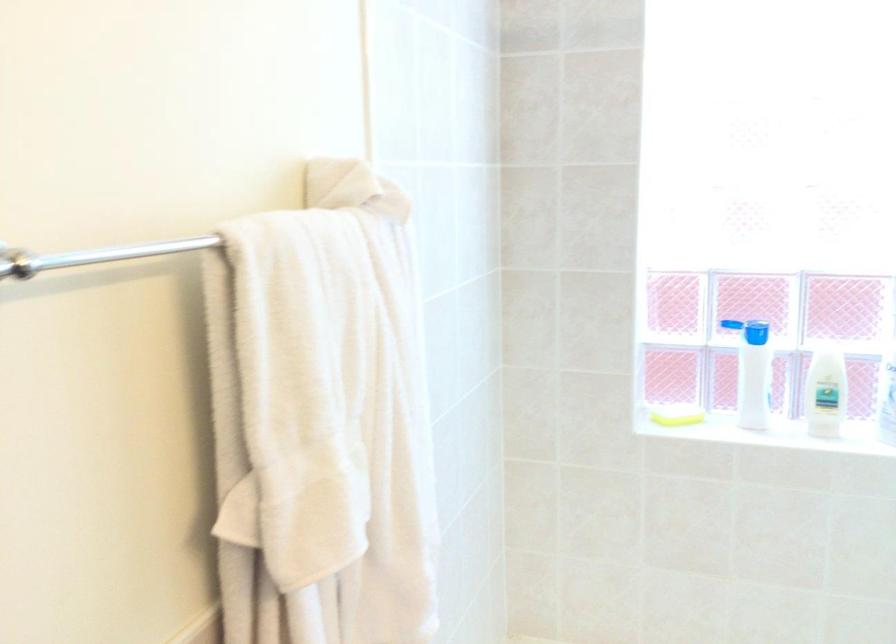
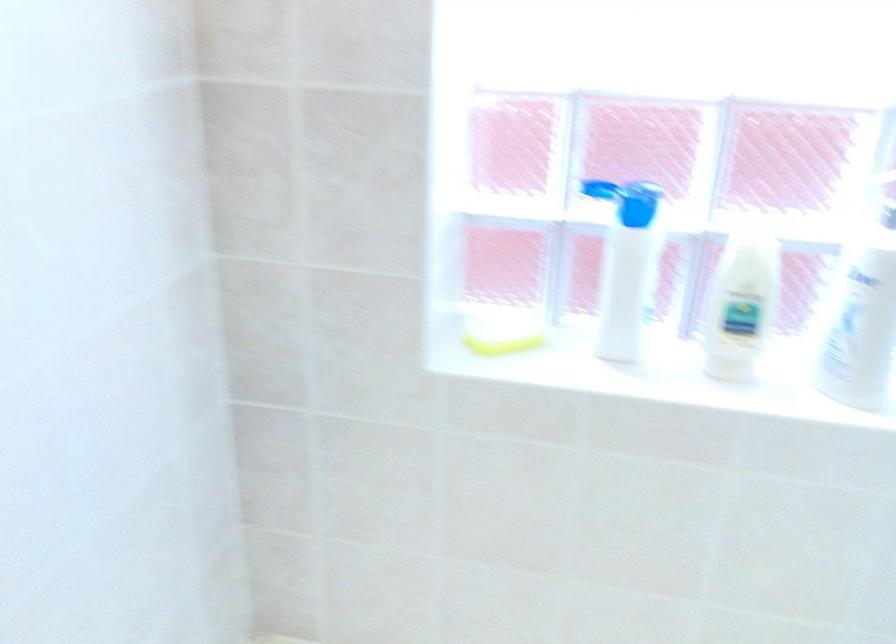
Question: The first image is from the beginning of the video and the second image is from the end. How did the camera likely rotate when shooting the video?

Choices:
 (A) Left
 (B) Right
 (C) Up
 (D) Down

Answer: (D)